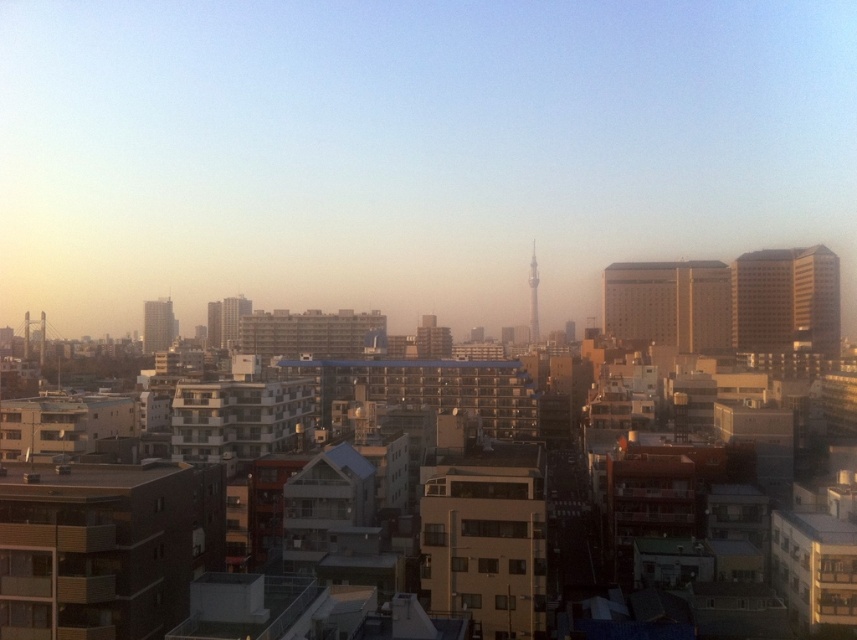
You are standing in the city looking at the beige concrete building at right and the matte gray building at left. Which building is located to the right of the other?

The beige concrete building at right is positioned on the right side of matte gray building at left.

You are standing at the center of the city and want to locate the beige concrete building at right. Based on the coordinates provided, in which direction should you look to find it?

The beige concrete building at right is located at coordinates point (x=784, y=300), so you should look to the right side of the scene.

You are standing in the cityscape scene and want to locate the point at coordinates (784, 300). According to the scene description, on which building would this point be located?

The point at coordinates (784, 300) is located on the beige concrete building at right.